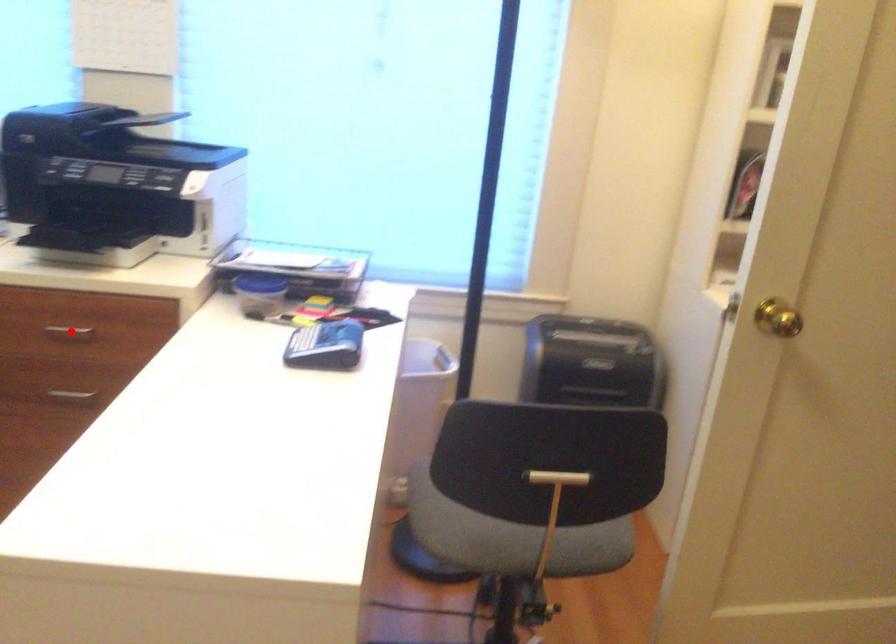
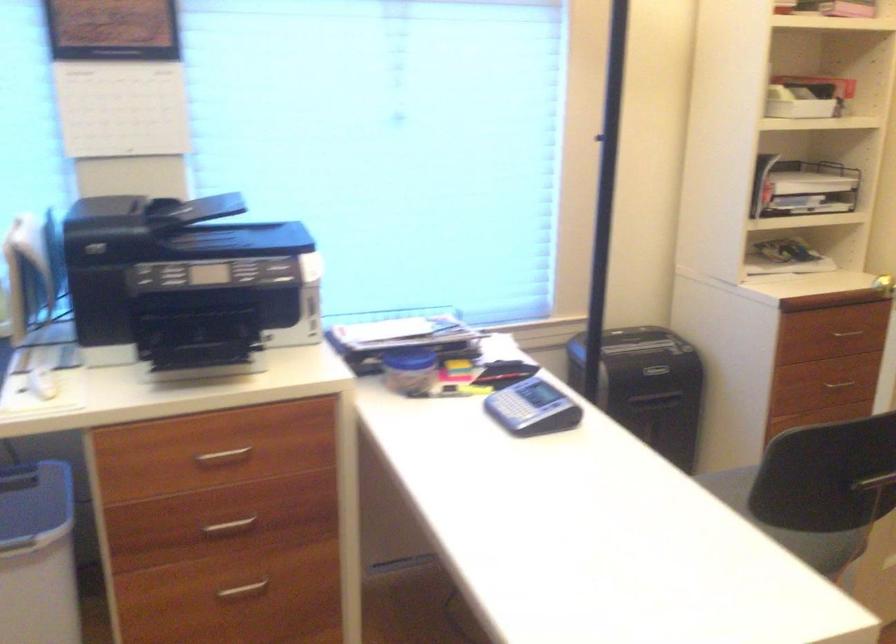
Find the pixel in the second image that matches the highlighted location in the first image.

(222, 457)